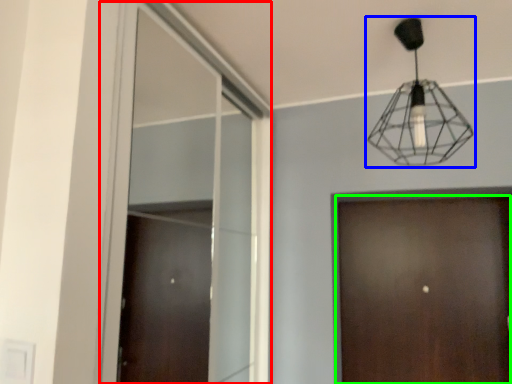
Question: Which object is the farthest from window (highlighted by a red box)? Choose among these: lamp (highlighted by a blue box) or door (highlighted by a green box).

Choices:
 (A) lamp
 (B) door

Answer: (A)